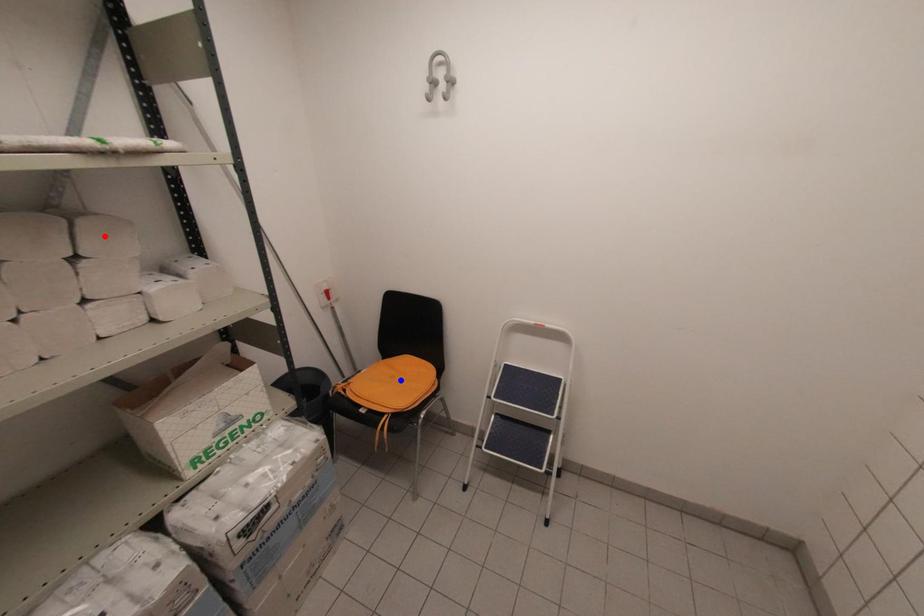
Question: In the image, two points are highlighted. Which point is nearer to the camera? Reply with the corresponding letter.

Choices:
 (A) blue point
 (B) red point

Answer: (B)